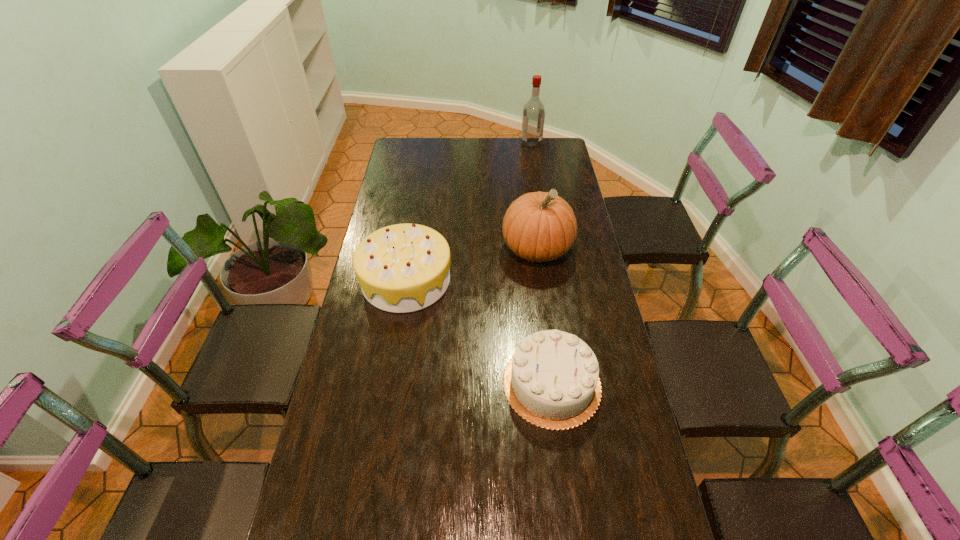
This screenshot has height=540, width=960. Find the location of `liquor`. liquor is located at coordinates (533, 119).

Locate an element on the screen. The image size is (960, 540). pumpkin is located at coordinates (539, 226).

The image size is (960, 540). What are the coordinates of `the left birthday cake` in the screenshot? It's located at (401, 268).

Locate an element on the screen. The image size is (960, 540). the farther birthday cake is located at coordinates (401, 268).

Identify the location of the shorter birthday cake. (552, 381).

Locate an element on the screen. the right birthday cake is located at coordinates (552, 381).

You are a GUI agent. You are given a task and a screenshot of the screen. Output one action in this format:
    pyautogui.click(x=<x>, y=<y>)
    Task: Click on the vacant space located on the front-facing side of the farthest object
    This screenshot has height=540, width=960.
    Given the screenshot: What is the action you would take?
    pyautogui.click(x=503, y=143)

Image resolution: width=960 pixels, height=540 pixels. Find the location of `vacant region located 0.100m on the front-facing side of the farthest object`. vacant region located 0.100m on the front-facing side of the farthest object is located at coordinates (501, 143).

Where is `vacant area situated 0.120m on the front-facing side of the farthest object`? The image size is (960, 540). vacant area situated 0.120m on the front-facing side of the farthest object is located at coordinates (497, 143).

This screenshot has width=960, height=540. What are the coordinates of `free space located on the stem of the third shortest object` in the screenshot? It's located at (549, 342).